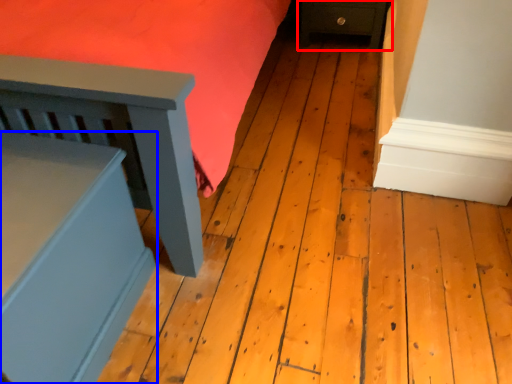
Question: Which of the following is the farthest to the observer, furniture (highlighted by a red box) or furniture (highlighted by a blue box)?

Choices:
 (A) furniture
 (B) furniture

Answer: (A)